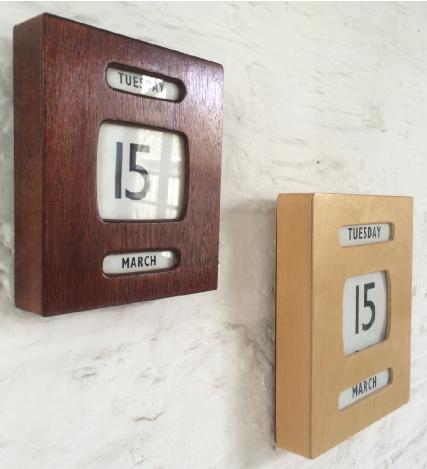
Identify the location of calender. (368, 263), (145, 111).